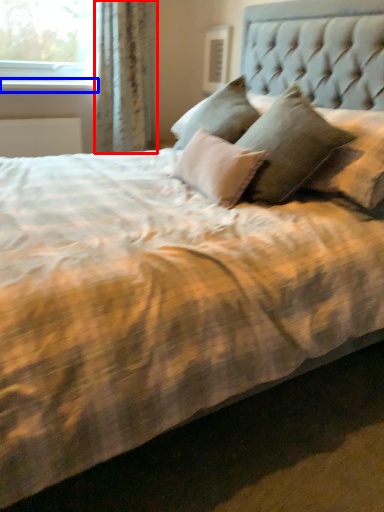
Question: Which object appears closest to the camera in this image, curtain (highlighted by a red box) or window sill (highlighted by a blue box)?

Choices:
 (A) curtain
 (B) window sill

Answer: (A)